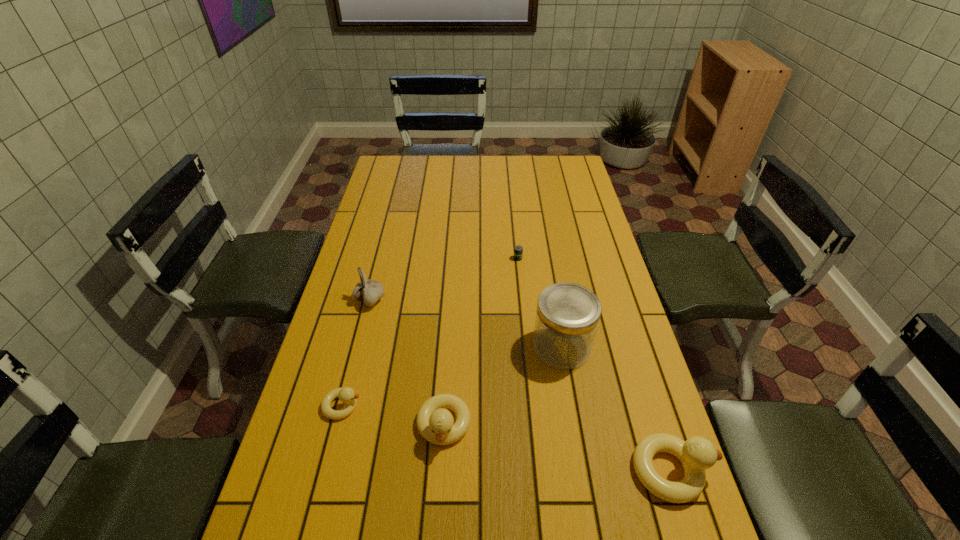
Where is `object located in the near right corner section of the desktop`? object located in the near right corner section of the desktop is located at coordinates [x=697, y=454].

The height and width of the screenshot is (540, 960). I want to click on vacant area at the far edge, so click(x=462, y=173).

Locate an element on the screen. free space at the near edge is located at coordinates (504, 507).

Find the location of a particular element. This screenshot has width=960, height=540. free spot at the left edge of the desktop is located at coordinates (392, 271).

Find the location of `blank space at the right edge of the desktop`. blank space at the right edge of the desktop is located at coordinates (568, 231).

Locate an element on the screen. free region at the far left corner of the desktop is located at coordinates (407, 180).

Image resolution: width=960 pixels, height=540 pixels. I want to click on free space at the far right corner, so click(565, 183).

I want to click on free space between the fifth tallest object and the rightmost object, so click(x=507, y=438).

At what (x,y) coordinates should I click in order to perform the action: click on free space that is in between the fifth nearest object and the rightmost object. Please return your answer as a coordinate pair (x, y). The width and height of the screenshot is (960, 540). Looking at the image, I should click on (520, 386).

The image size is (960, 540). Find the location of `vacant space in between the rightmost object and the shortest object`. vacant space in between the rightmost object and the shortest object is located at coordinates (594, 364).